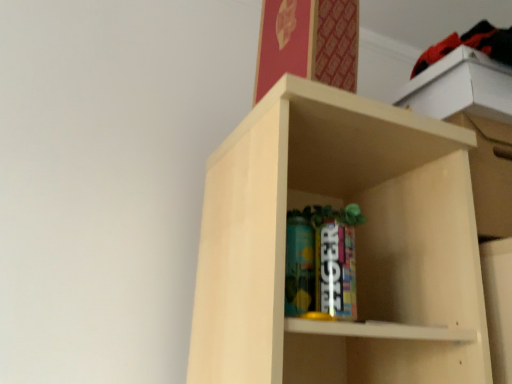
At what (x,y) coordinates should I click in order to perform the action: click on white matte cabinet at upper right. Please return your answer as a coordinate pair (x, y). Image resolution: width=512 pixels, height=384 pixels. Looking at the image, I should click on (460, 87).

Measure the distance between point (485, 67) and camera.

Point (485, 67) and camera are 89.90 centimeters apart from each other.

Describe the element at coordinates (460, 87) in the screenshot. I see `white matte cabinet at upper right` at that location.

This screenshot has height=384, width=512. Find the location of `white matte cabinet at upper right`. white matte cabinet at upper right is located at coordinates (460, 87).